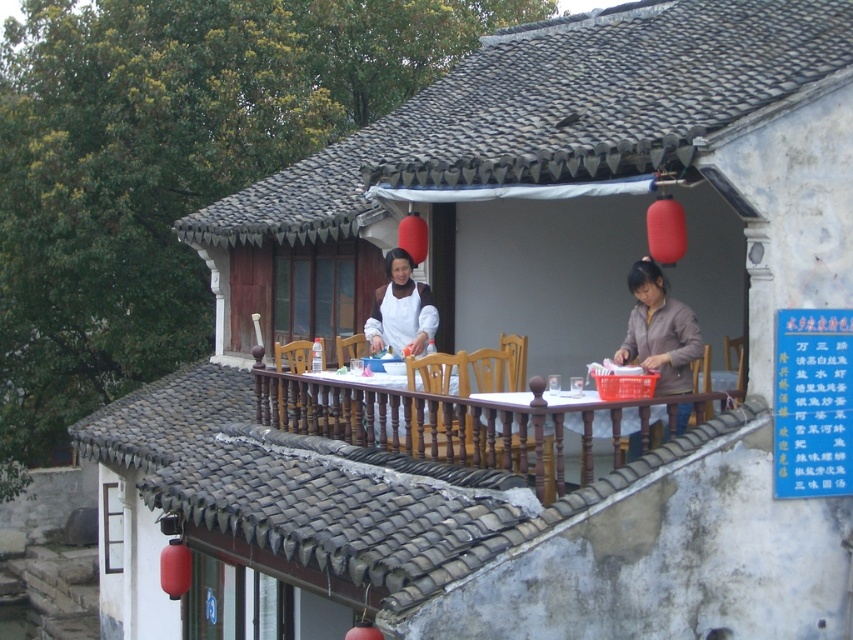
Does wooden table at center appear on the left side of matte white apron at center?

No, wooden table at center is not to the left of matte white apron at center.

Does wooden table at center have a smaller size compared to matte white apron at center?

No.

Is point (585, 451) closer to viewer compared to point (383, 312)?

Yes, it is.

What are the coordinates of `wooden table at center` in the screenshot? It's located at (585, 420).

Is brown matte jacket at upper right wider than matte white apron at center?

No.

Which of these two, brown matte jacket at upper right or matte white apron at center, stands taller?

brown matte jacket at upper right

Image resolution: width=853 pixels, height=640 pixels. What are the coordinates of `brown matte jacket at upper right` in the screenshot? It's located at (659, 330).

Who is taller, wooden table at center or brown matte jacket at upper right?

Standing taller between the two is brown matte jacket at upper right.

Between wooden table at center and brown matte jacket at upper right, which one has less height?

wooden table at center is shorter.

You are a GUI agent. You are given a task and a screenshot of the screen. Output one action in this format:
    pyautogui.click(x=<x>, y=<y>)
    Task: Click on the wooden table at center
    This screenshot has width=853, height=640.
    Given the screenshot: What is the action you would take?
    pyautogui.click(x=585, y=420)

The height and width of the screenshot is (640, 853). Identify the location of wooden table at center. (585, 420).